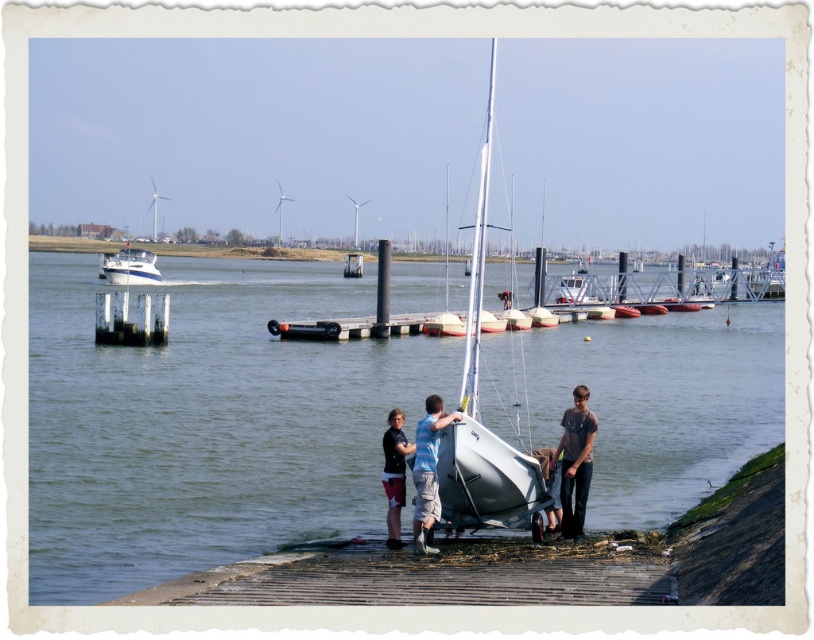
You are standing on the wooden dock and want to walk to the point marked at coordinates (x=475, y=508). There is an obstacle at point (x=357, y=282). Will you encounter this obstacle before reaching your destination?

Yes, you will encounter the obstacle at point (x=357, y=282) before reaching the destination at point (x=475, y=508) because point (x=357, y=282) is closer to you than point (x=475, y=508).

You are standing on the wooden dock and want to place a new lifebuoy between the white matte sailboat at center and the dark gray jeans at lower right. Based on their positions, where should you position the lifebuoy?

The white matte sailboat at center is located above the dark gray jeans at lower right, so you should place the lifebuoy between them in the space below the sailboat and above the jeans.

Looking at this image, you are standing at the point marked as point [36,557] and want to throw a frisbee to a friend who is 15 meters away from you. Is your friend within reach?

The distance between you and the friend is 15 meters, which is less than the 17.65 meters between the point [36,557] and the viewer. Therefore, the friend is within reach.